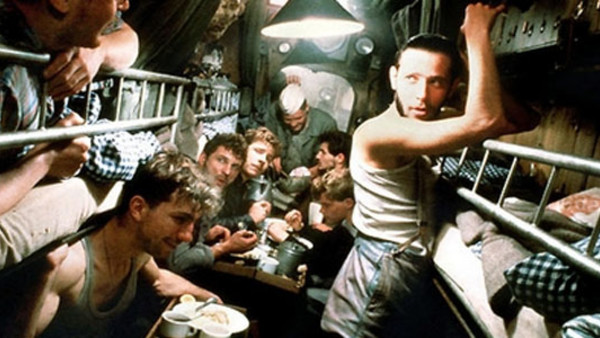
Identify the location of plate. (238, 325).